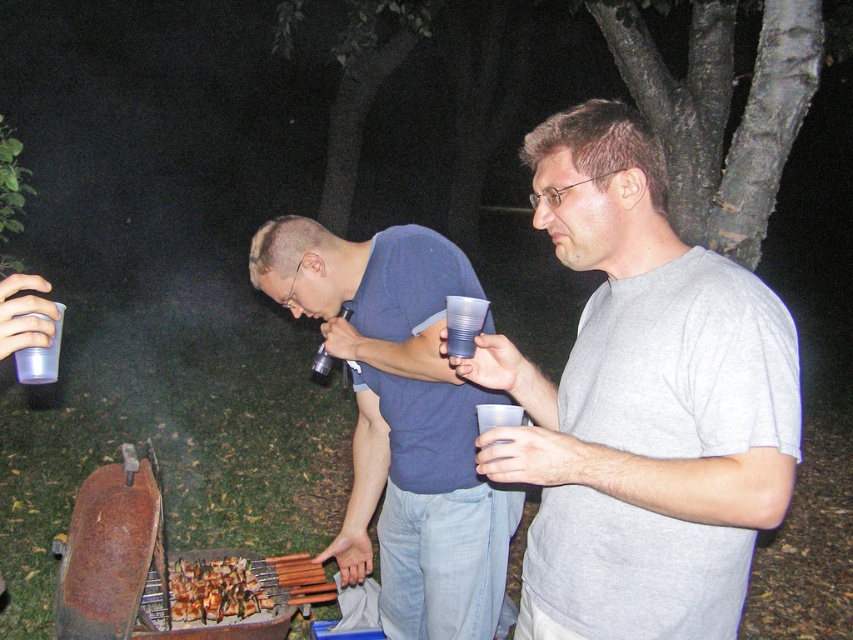
Question: In this image, where is grilled meat skewers at center located relative to transparent plastic cup at lower left?

Choices:
 (A) right
 (B) left

Answer: (A)

Question: Estimate the real-world distances between objects in this image. Which object is farther from the transparent plastic cup at lower left?

Choices:
 (A) grilled meat skewers at center
 (B) brown wooden skewers at center

Answer: (B)

Question: Observing the image, what is the correct spatial positioning of transparent plastic cup at center in reference to transparent plastic cup at lower left?

Choices:
 (A) below
 (B) above

Answer: (B)

Question: Based on their relative distances, which object is nearer to the gray matte t-shirt at center?

Choices:
 (A) transparent plastic cup at lower left
 (B) blue matte shirt at center
 (C) brown wooden skewers at center
 (D) grilled meat skewers at center

Answer: (B)

Question: Is blue matte shirt at center above transparent plastic cup at center?

Choices:
 (A) yes
 (B) no

Answer: (B)

Question: Which object appears farthest from the camera in this image?

Choices:
 (A) gray matte t-shirt at center
 (B) transparent plastic cup at center

Answer: (B)